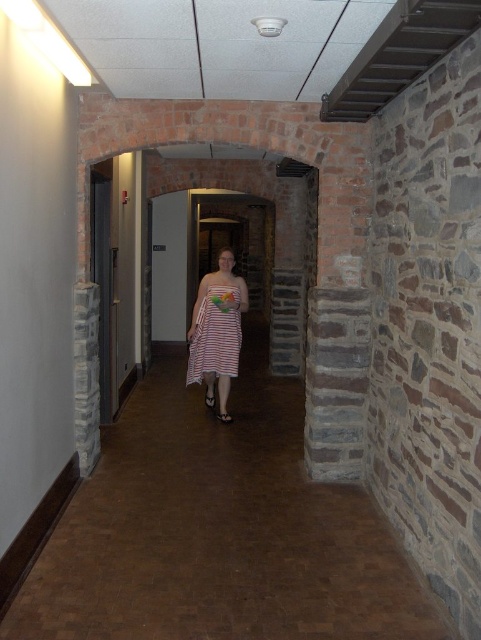
How far apart are striped fabric dress at center and striped cotton dress at center?

striped fabric dress at center and striped cotton dress at center are 2.33 inches apart from each other.

Does striped fabric dress at center appear under striped cotton dress at center?

Incorrect, striped fabric dress at center is not positioned below striped cotton dress at center.

Is point (214, 340) behind point (202, 333)?

No, (214, 340) is in front of (202, 333).

The width and height of the screenshot is (481, 640). Identify the location of striped fabric dress at center. (216, 333).

Can you confirm if brown polished wood floor at center is positioned to the left of striped cotton dress at center?

In fact, brown polished wood floor at center is to the right of striped cotton dress at center.

What do you see at coordinates (218, 531) in the screenshot? I see `brown polished wood floor at center` at bounding box center [218, 531].

Is point (33, 595) closer to camera compared to point (222, 352)?

Yes.

Locate an element on the screen. The image size is (481, 640). brown polished wood floor at center is located at coordinates (218, 531).

Which is in front, point (237, 321) or point (217, 307)?

Point (217, 307)

Based on the photo, is striped fabric dress at center positioned in front of translucent plastic bouquet at center?

Yes, striped fabric dress at center is closer to the viewer.

Does point (192, 323) come farther from viewer compared to point (222, 300)?

Yes, it is behind point (222, 300).

The height and width of the screenshot is (640, 481). What are the coordinates of `striped fabric dress at center` in the screenshot? It's located at (216, 333).